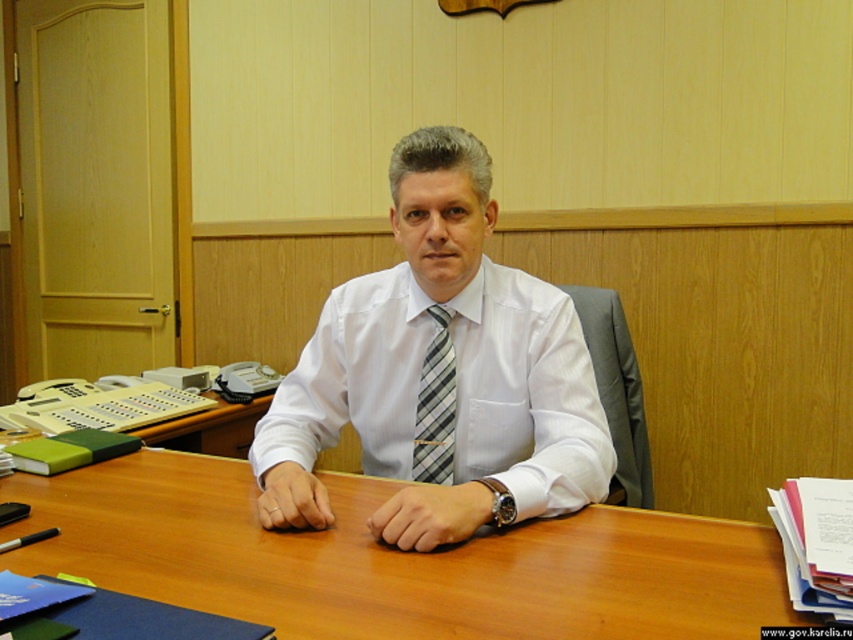
You are an office assistant who needs to place a new document organizer on the desk. The organizer requires a space larger than the wooden at center. Is there enough space on the desk next to the white striped tie at center?

The wooden at center has a smaller size compared to white striped tie at center. Therefore, the space next to the white striped tie at center may be sufficient for the document organizer if it is larger than the wooden at center, but the exact dimensions of the desk and other items are not provided.

You are standing in front of the desk. Which object, the wooden at center or the gray striped tie at center, is closer to you?

The wooden at center is closer to you than the gray striped tie at center.